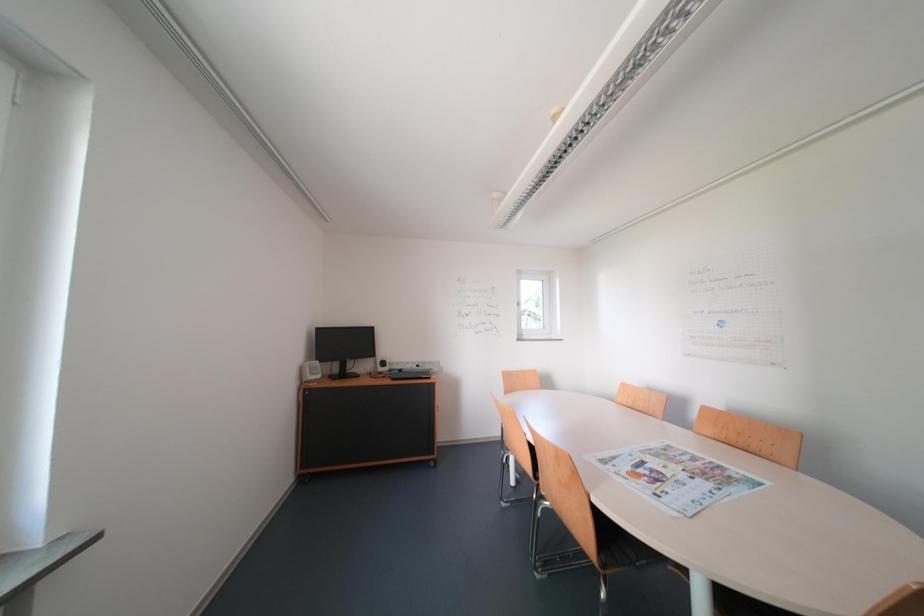
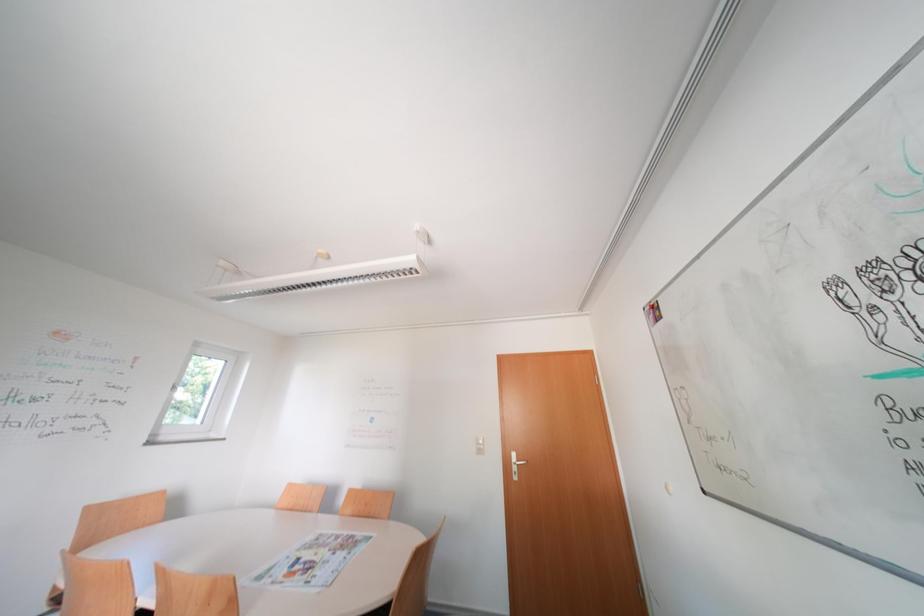
From the picture: The first image is from the beginning of the video and the second image is from the end. How did the camera likely rotate when shooting the video?

The camera rotated toward right-up.